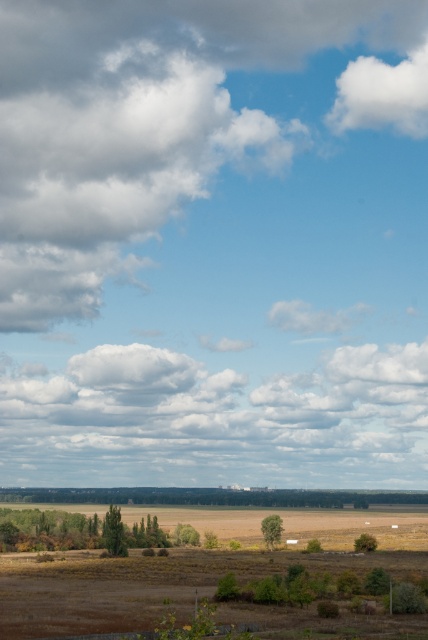
Is brown grassland at lower center thinner than white fluffy cloud at upper right?

In fact, brown grassland at lower center might be wider than white fluffy cloud at upper right.

Does point (98, 499) come farther from viewer compared to point (347, 93)?

No, (98, 499) is in front of (347, 93).

Measure the distance between brown grassland at lower center and camera.

1310.13 feet

You are a GUI agent. You are given a task and a screenshot of the screen. Output one action in this format:
    pyautogui.click(x=<x>, y=<y>)
    Task: Click on the brown grassland at lower center
    The image size is (428, 640).
    Given the screenshot: What is the action you would take?
    pyautogui.click(x=211, y=497)

Does brown dry grassland at lower center have a greater height compared to brown grassland at lower center?

Indeed, brown dry grassland at lower center has a greater height compared to brown grassland at lower center.

Can you confirm if brown dry grassland at lower center is shorter than brown grassland at lower center?

Incorrect, brown dry grassland at lower center's height does not fall short of brown grassland at lower center's.

I want to click on brown dry grassland at lower center, so click(211, 576).

Is brown dry grassland at lower center to the left of white fluffy cloud at upper right from the viewer's perspective?

Yes, brown dry grassland at lower center is to the left of white fluffy cloud at upper right.

Between point (397, 566) and point (371, 86), which one is positioned in front?

Point (397, 566)

At what (x,y) coordinates should I click in order to perform the action: click on brown dry grassland at lower center. Please return your answer as a coordinate pair (x, y). Looking at the image, I should click on (211, 576).